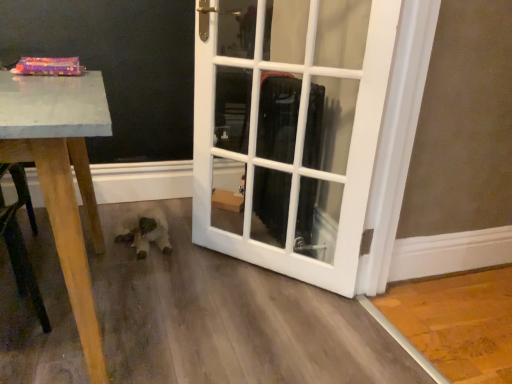
You are a GUI agent. You are given a task and a screenshot of the screen. Output one action in this format:
    pyautogui.click(x=<x>, y=<y>)
    Task: Click on the free spot to the left of white glossy door at center
    
    Given the screenshot: What is the action you would take?
    [137, 275]